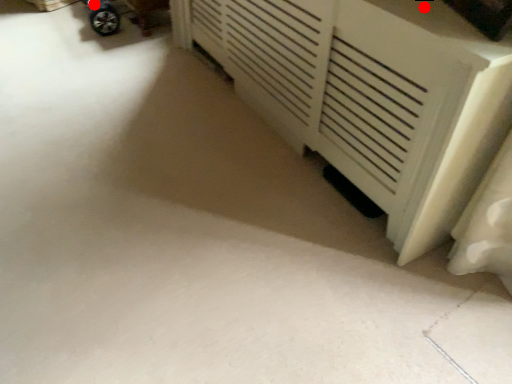
Question: Two points are circled on the image, labeled by A and B beside each circle. Which point appears closest to the camera in this image?

Choices:
 (A) A is closer
 (B) B is closer

Answer: (A)